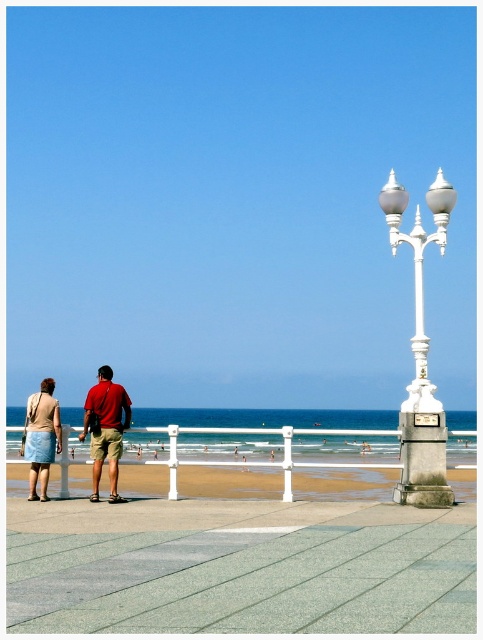
Can you confirm if smooth sand beach at center is bigger than denim skirt at lower left?

Indeed, smooth sand beach at center has a larger size compared to denim skirt at lower left.

Locate an element on the screen. This screenshot has width=483, height=640. smooth sand beach at center is located at coordinates (264, 461).

Does smooth sand beach at center have a greater width compared to white polished metal lamp post at right?

Indeed, smooth sand beach at center has a greater width compared to white polished metal lamp post at right.

Who is more distant from viewer, [143,429] or [423,483]?

Point [143,429]

Who is more distant from viewer, (370, 492) or (450, 502)?

The point (370, 492) is behind.

Where is `smooth sand beach at center`? smooth sand beach at center is located at coordinates tap(264, 461).

Which is more to the right, smooth sand beach at center or red cotton shirt at center?

smooth sand beach at center

Does smooth sand beach at center have a greater height compared to red cotton shirt at center?

Correct, smooth sand beach at center is much taller as red cotton shirt at center.

Is point (154, 442) positioned before point (109, 440)?

No, it is not.

Identify the location of smooth sand beach at center. (264, 461).